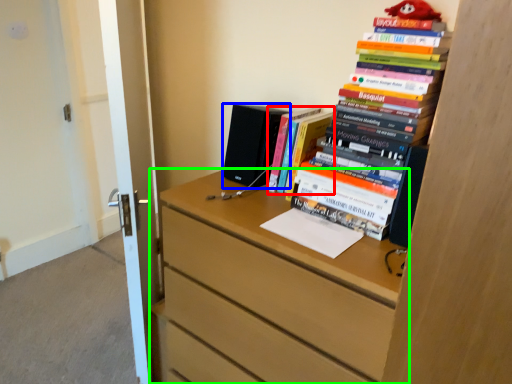
Question: Estimate the real-world distances between objects in this image. Which object is farther from book (highlighted by a red box), speaker (highlighted by a blue box) or chest of drawers (highlighted by a green box)?

Choices:
 (A) speaker
 (B) chest of drawers

Answer: (B)